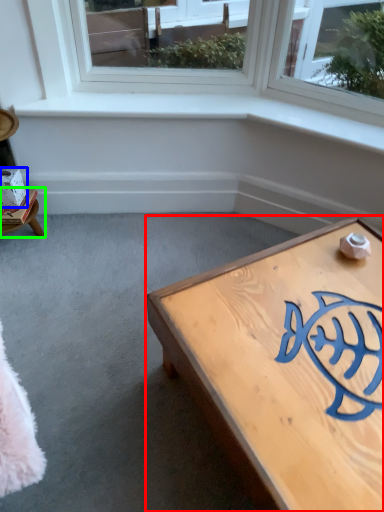
Question: Which is nearer to the coffee table (highlighted by a red box)? box (highlighted by a blue box) or furniture (highlighted by a green box).

Choices:
 (A) box
 (B) furniture

Answer: (B)